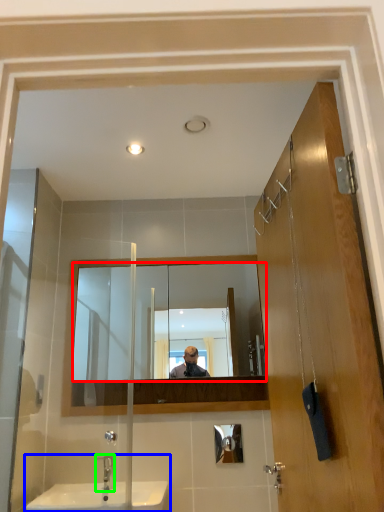
Question: Which object is positioned farthest from mirror (highlighted by a red box)? Select from sink (highlighted by a blue box) and tap (highlighted by a green box).

Choices:
 (A) sink
 (B) tap

Answer: (B)